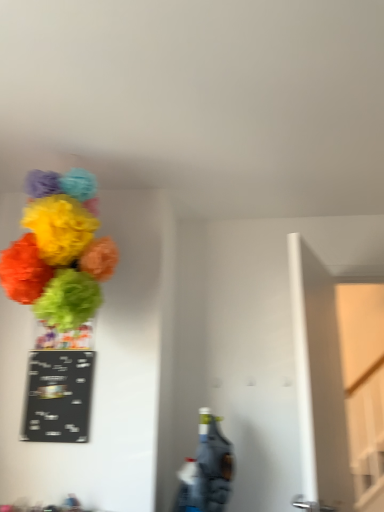
Question: In terms of size, does bright paper pom-poms at upper left appear bigger or smaller than green matte vase at upper left?

Choices:
 (A) big
 (B) small

Answer: (A)

Question: Is bright paper pom-poms at upper left wider or thinner than green matte vase at upper left?

Choices:
 (A) wide
 (B) thin

Answer: (A)

Question: Estimate the real-world distances between objects in this image. Which object is farther from the green matte vase at upper left?

Choices:
 (A) bright paper pom-poms at upper left
 (B) black chalkboard at left

Answer: (A)

Question: Based on their relative distances, which object is farther from the green matte vase at upper left?

Choices:
 (A) bright paper pom-poms at upper left
 (B) black chalkboard at left

Answer: (A)